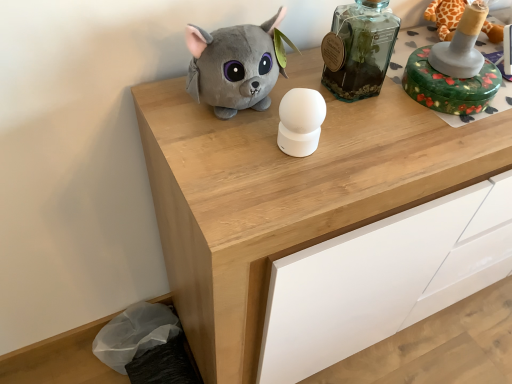
In order to click on vacant region to the left of soft plush cat at upper center, which is the 1th toy in left-to-right order in this screenshot , I will do `click(162, 104)`.